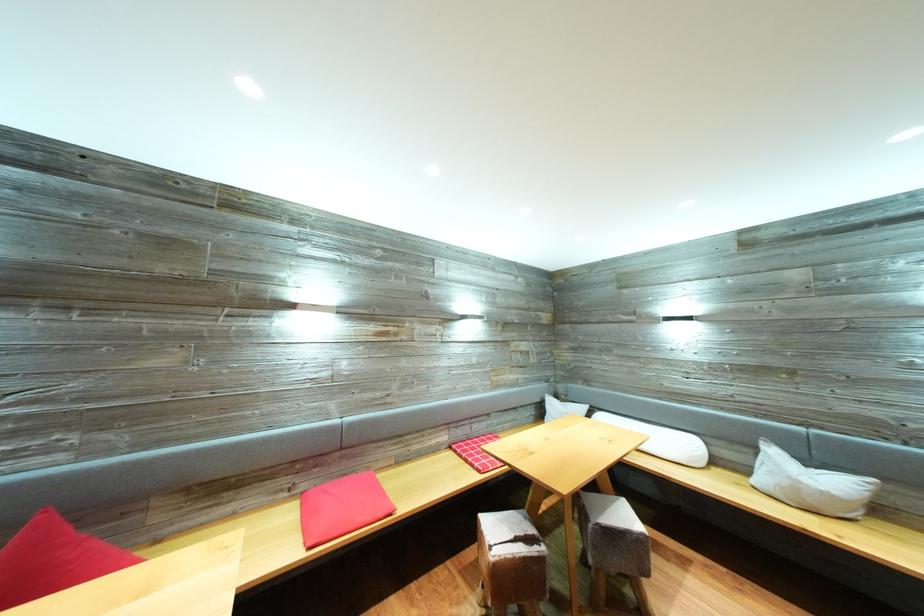
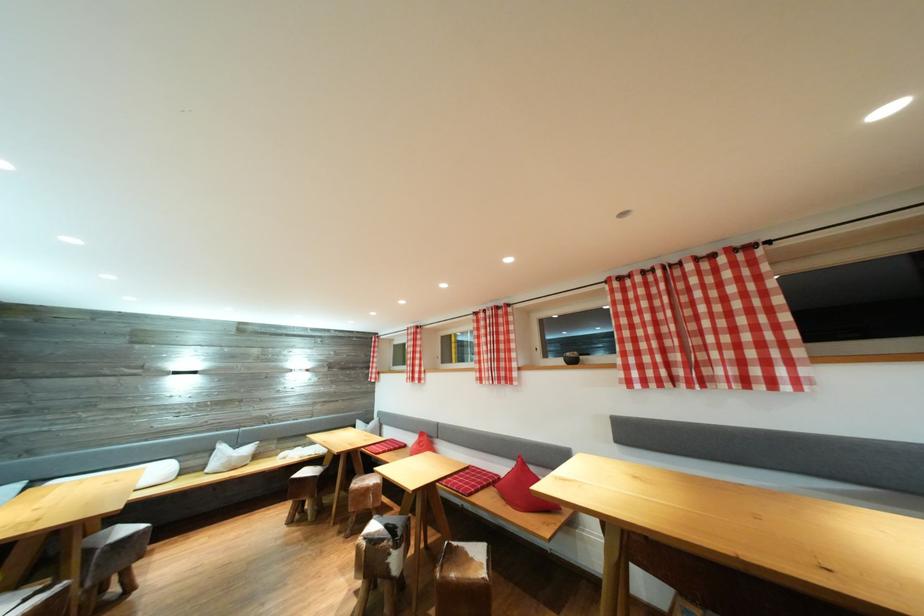
The point at (781, 458) is marked in the first image. Where is the corresponding point in the second image?

(228, 453)